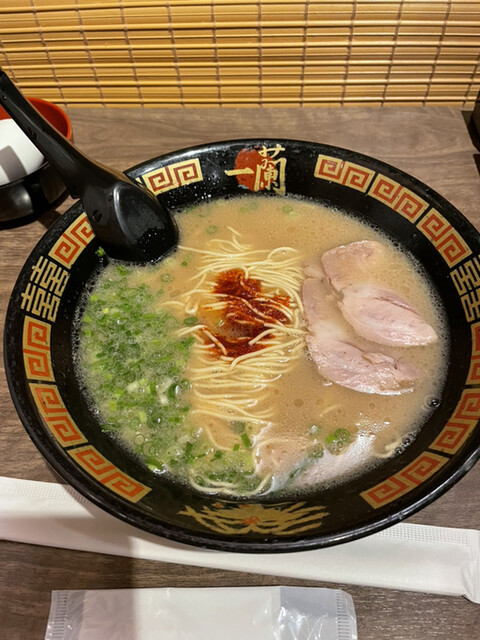
Where is `horizontal bamboo sticks in the blinds going down the center of the photo`? This screenshot has height=640, width=480. horizontal bamboo sticks in the blinds going down the center of the photo is located at coordinates (238, 2), (238, 26), (242, 34), (240, 43), (239, 54), (237, 61), (242, 75), (242, 82), (241, 100).